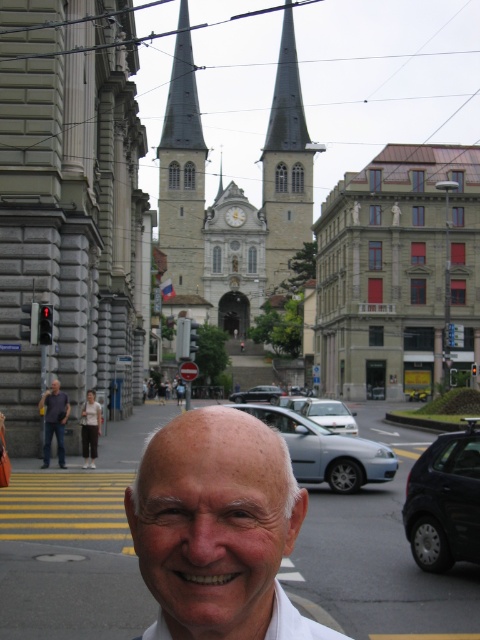
Question: Which point is farther to the camera?

Choices:
 (A) (311, 148)
 (B) (240, 426)
 (C) (44, 438)

Answer: (A)

Question: Considering the relative positions of gray stone church at center and satin black suv at center in the image provided, where is gray stone church at center located with respect to satin black suv at center?

Choices:
 (A) below
 (B) above

Answer: (B)

Question: Among these objects, which one is nearest to the camera?

Choices:
 (A) dark blue shirt at center
 (B) gray stone tower at center
 (C) white cotton dress shirt at lower left
 (D) smooth gray steeple at center

Answer: (A)

Question: Which object appears closest to the camera in this image?

Choices:
 (A) white matte face at center
 (B) white cotton shirt at center
 (C) white cotton dress shirt at lower left
 (D) dark blue shirt at center

Answer: (B)

Question: In this image, where is red brick building at center located relative to gray stone tower at center?

Choices:
 (A) below
 (B) above

Answer: (A)

Question: Is white cotton shirt at center to the left of satin black suv at center from the viewer's perspective?

Choices:
 (A) no
 (B) yes

Answer: (B)